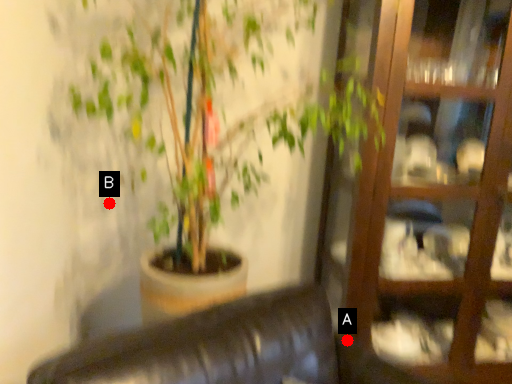
Question: Two points are circled on the image, labeled by A and B beside each circle. Which point appears closest to the camera in this image?

Choices:
 (A) A is closer
 (B) B is closer

Answer: (A)